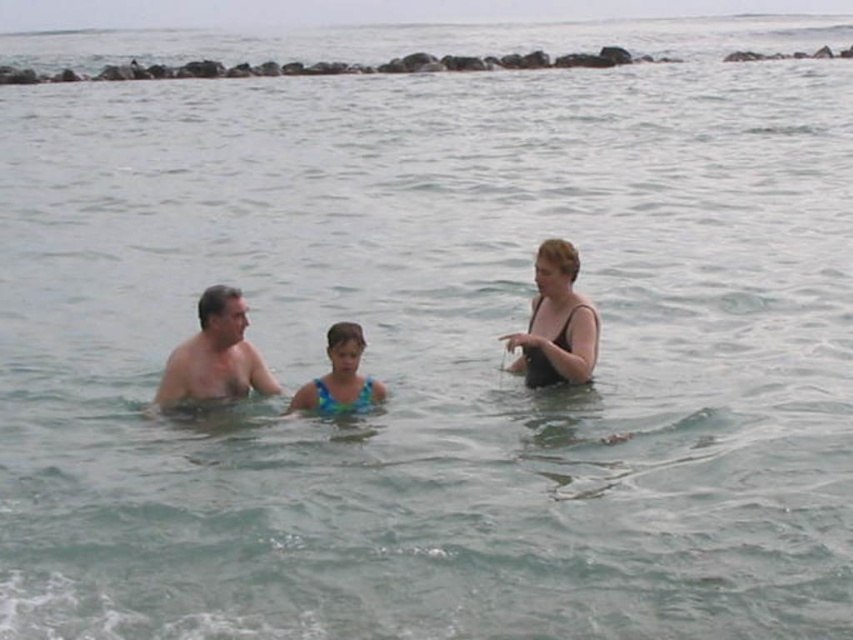
Consider the image. Can you confirm if black matte swimsuit at center is bigger than blue textured swimsuit at center?

Yes, black matte swimsuit at center is bigger than blue textured swimsuit at center.

Is black matte swimsuit at center below blue textured swimsuit at center?

Actually, black matte swimsuit at center is above blue textured swimsuit at center.

Is point (549, 337) less distant than point (357, 403)?

That is False.

Identify the location of black matte swimsuit at center. (556, 323).

Looking at this image, which of these two, blue printed swimsuit at center or blue textured swimsuit at center, stands taller?

blue printed swimsuit at center is taller.

From the picture: Does blue printed swimsuit at center have a greater height compared to blue textured swimsuit at center?

Correct, blue printed swimsuit at center is much taller as blue textured swimsuit at center.

Is point (358, 380) behind point (314, 381)?

That is True.

Where is `blue printed swimsuit at center`? blue printed swimsuit at center is located at coordinates (340, 376).

Can you confirm if skinny white man at left is thinner than blue printed swimsuit at center?

No.

Who is more distant from viewer, (165, 365) or (375, 384)?

The point (165, 365) is more distant.

You are a GUI agent. You are given a task and a screenshot of the screen. Output one action in this format:
    pyautogui.click(x=<x>, y=<y>)
    Task: Click on the skinny white man at left
    Image resolution: width=853 pixels, height=640 pixels.
    Given the screenshot: What is the action you would take?
    pyautogui.click(x=215, y=355)